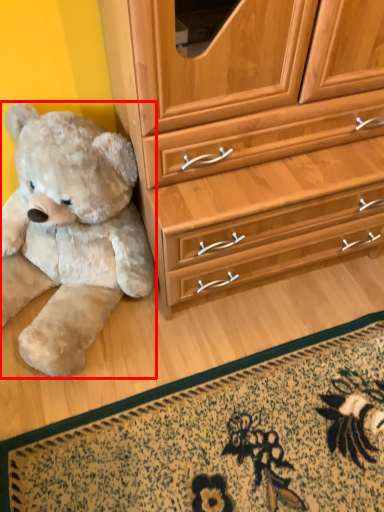
Question: From the image's perspective, where is teddy bear (annotated by the red box) located in relation to doormat in the image?

Choices:
 (A) above
 (B) below

Answer: (A)